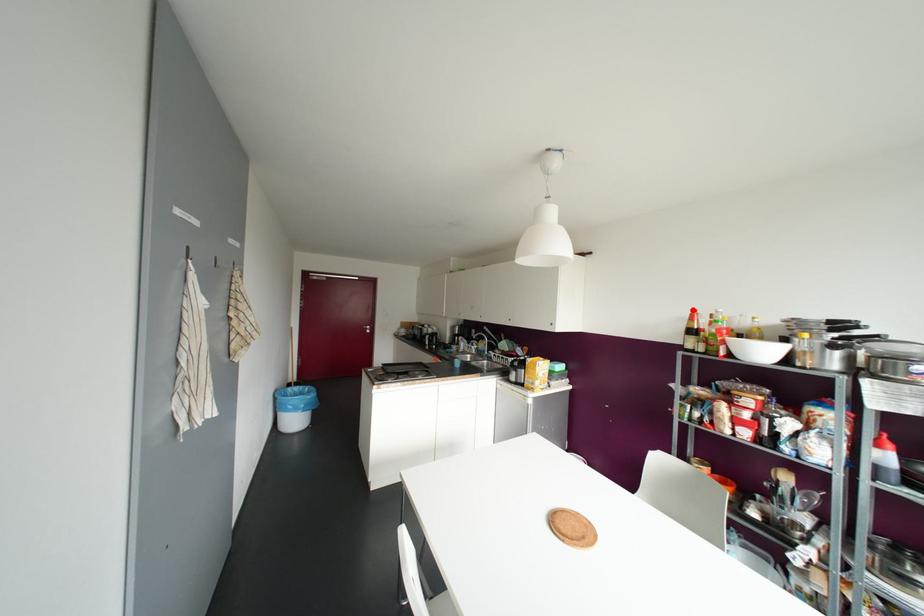
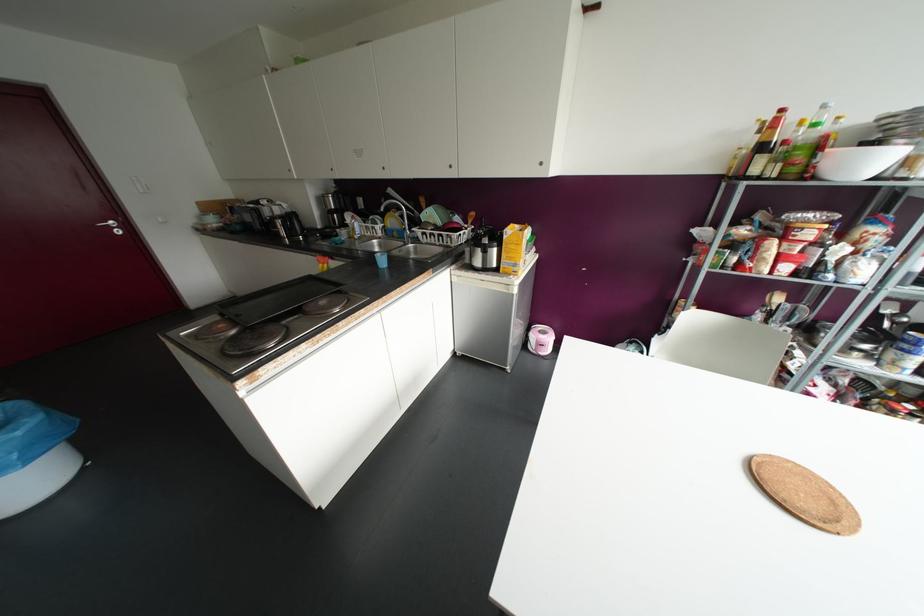
In the second image, find the point that corresponds to the highlighted location in the first image.

(781, 110)